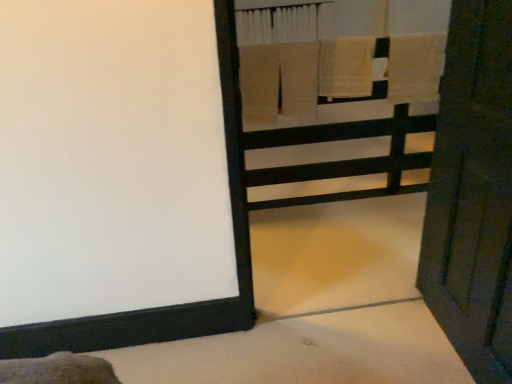
Question: From a real-world perspective, does beige cotton towel at upper right, the 1th bath towel in the right-to-left sequence, sit lower than beige cotton towel at upper center, which ranks as the first bath towel in left-to-right order?

Choices:
 (A) yes
 (B) no

Answer: (B)

Question: Does beige cotton towel at upper right, the 2th bath towel positioned from the left, have a greater width compared to beige cotton towel at upper center, which ranks as the first bath towel in left-to-right order?

Choices:
 (A) yes
 (B) no

Answer: (B)

Question: Does beige cotton towel at upper right, the 2th bath towel positioned from the left, turn towards beige cotton towel at upper center, which is the second bath towel in right-to-left order?

Choices:
 (A) no
 (B) yes

Answer: (A)

Question: Does beige cotton towel at upper right, the 2th bath towel positioned from the left, have a lesser width compared to beige cotton towel at upper center, which ranks as the first bath towel in left-to-right order?

Choices:
 (A) no
 (B) yes

Answer: (B)

Question: From the image's perspective, is beige cotton towel at upper right, the 2th bath towel positioned from the left, below beige cotton towel at upper center, which ranks as the first bath towel in left-to-right order?

Choices:
 (A) yes
 (B) no

Answer: (B)

Question: Considering their positions, is beige cotton towel at upper center, which is the second bath towel in right-to-left order, located in front of or behind wooden bunk bed at upper right?

Choices:
 (A) front
 (B) behind

Answer: (B)

Question: Is point (352, 57) closer or farther from the camera than point (314, 94)?

Choices:
 (A) closer
 (B) farther

Answer: (A)

Question: From the image's perspective, is beige cotton towel at upper center, which is the second bath towel in right-to-left order, located above or below wooden bunk bed at upper right?

Choices:
 (A) above
 (B) below

Answer: (A)

Question: Choose the correct answer: Is beige cotton towel at upper center, which is the second bath towel in right-to-left order, inside wooden bunk bed at upper right or outside it?

Choices:
 (A) outside
 (B) inside

Answer: (A)

Question: Is wooden bunk bed at upper right in front of or behind wooden door at right in the image?

Choices:
 (A) behind
 (B) front

Answer: (A)

Question: Is point (359, 74) positioned closer to the camera than point (493, 43)?

Choices:
 (A) farther
 (B) closer

Answer: (A)

Question: Choose the correct answer: Is wooden bunk bed at upper right inside wooden door at right or outside it?

Choices:
 (A) outside
 (B) inside

Answer: (A)

Question: From a real-world perspective, is wooden bunk bed at upper right above or below wooden door at right?

Choices:
 (A) below
 (B) above

Answer: (B)

Question: From a real-world perspective, is beige cotton towel at upper center, which is the second bath towel in right-to-left order, positioned above or below beige cotton towel at upper right, the 1th bath towel in the right-to-left sequence?

Choices:
 (A) below
 (B) above

Answer: (A)

Question: Considering the positions of beige cotton towel at upper center, which ranks as the first bath towel in left-to-right order, and beige cotton towel at upper right, the 1th bath towel in the right-to-left sequence, in the image, is beige cotton towel at upper center, which ranks as the first bath towel in left-to-right order, taller or shorter than beige cotton towel at upper right, the 1th bath towel in the right-to-left sequence,?

Choices:
 (A) tall
 (B) short

Answer: (A)